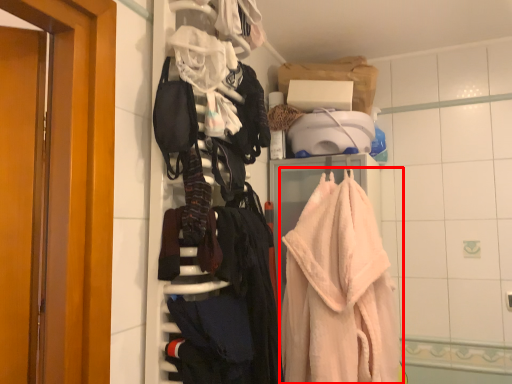
Question: Considering the relative positions of towel (annotated by the red box) and clothing in the image provided, where is towel (annotated by the red box) located with respect to the staircase?

Choices:
 (A) left
 (B) right

Answer: (B)